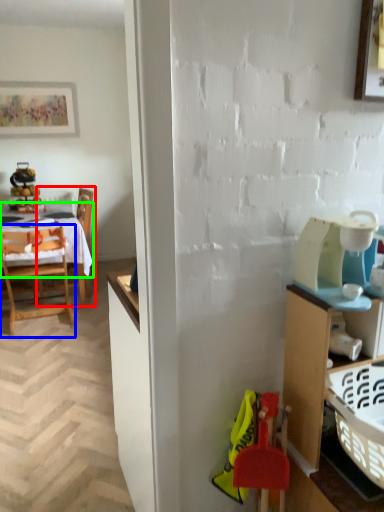
Question: Considering the real-world distances, which object is closest to chair (highlighted by a red box)? chair (highlighted by a blue box) or tablecloth (highlighted by a green box).

Choices:
 (A) chair
 (B) tablecloth

Answer: (B)